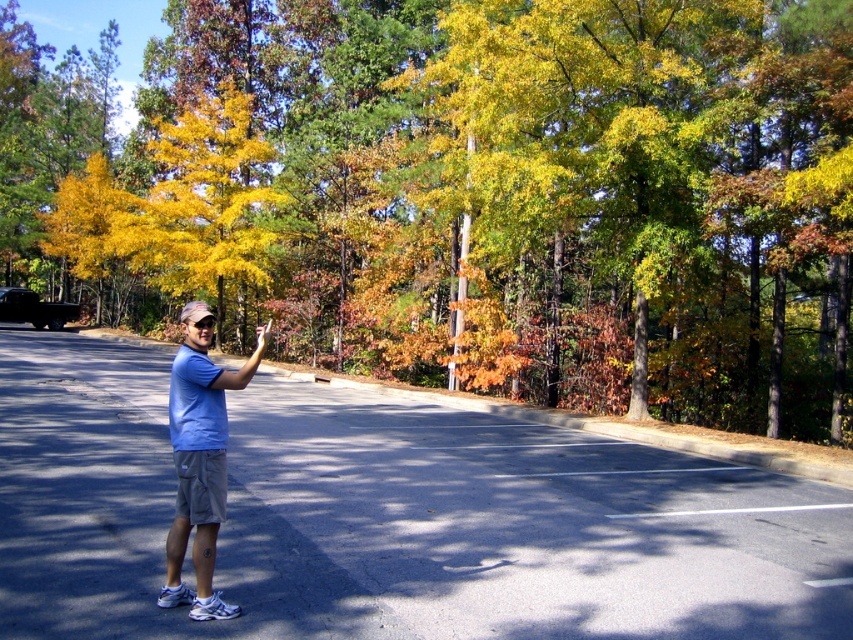
You are standing on the left side of the road and want to take a photo of the yellow leafy tree at center. Which direction should you face to capture the tree in your view?

You should face towards the center of the road to capture the yellow leafy tree at center in your view since it is located at point (469, 195).

You are a photographer wanting to capture the yellow leafy tree at center and the blue cotton shirt at center in your shot. Given their sizes, which object would appear bigger in the photo?

The yellow leafy tree at center would appear bigger in the photo since it is larger in size than the blue cotton shirt at center according to the description.